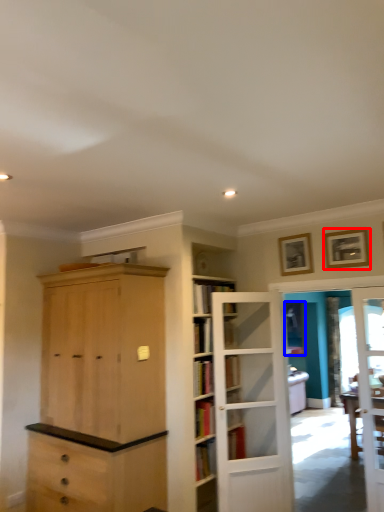
Question: Which point is closer to the camera, picture frame (highlighted by a red box) or window (highlighted by a blue box)?

Choices:
 (A) picture frame
 (B) window

Answer: (A)